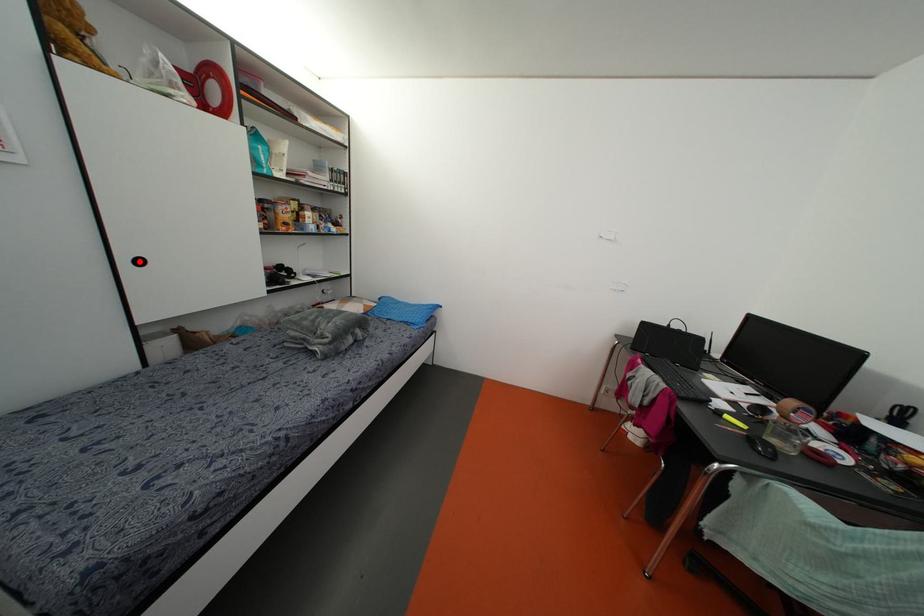
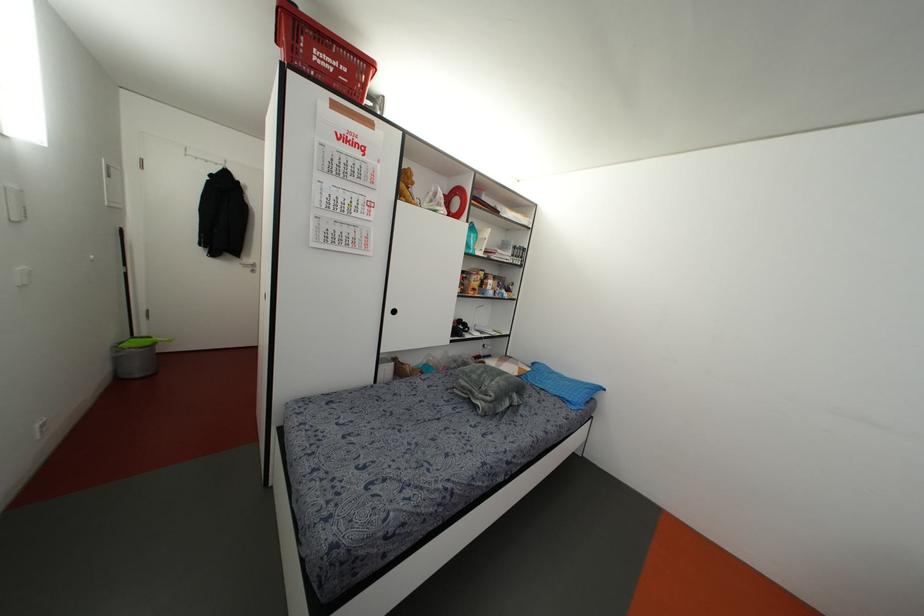
In the second image, find the point that corresponds to the highlighted location in the first image.

(394, 310)